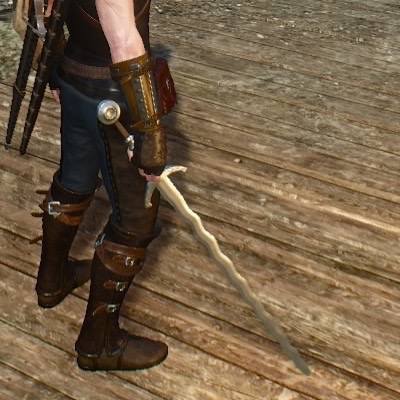
The image size is (400, 400). I want to click on floor, so click(265, 156).